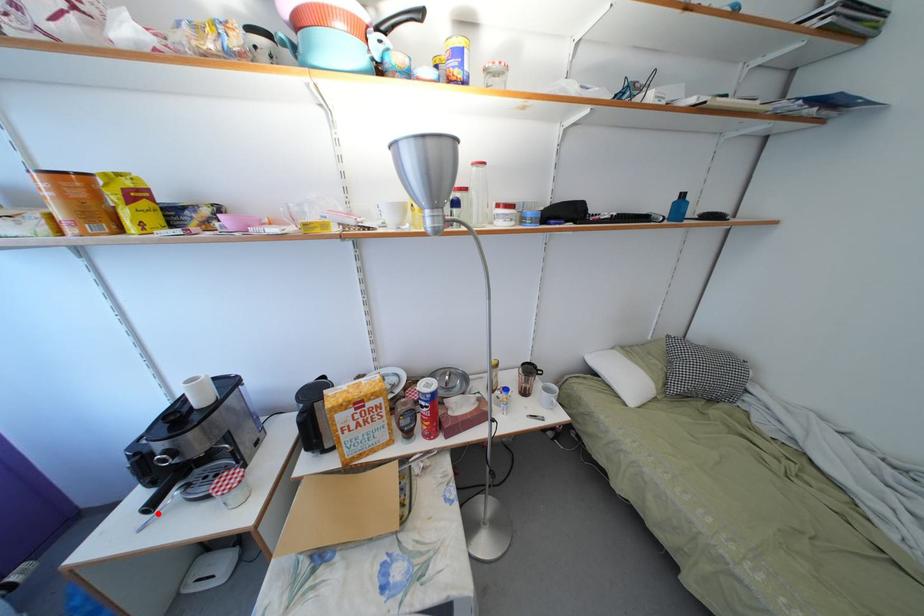
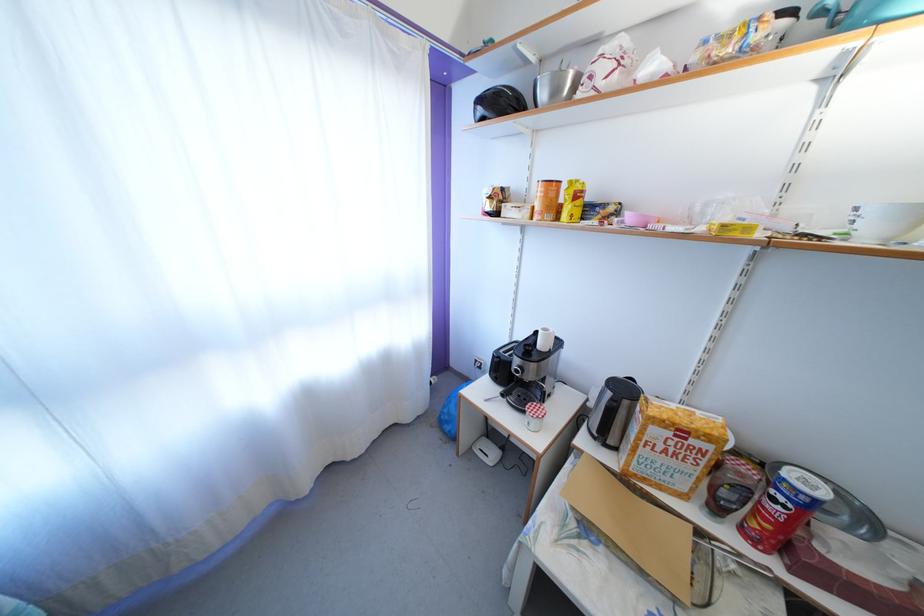
Locate, in the second image, the point that corresponds to the highlighted location in the first image.

(507, 400)